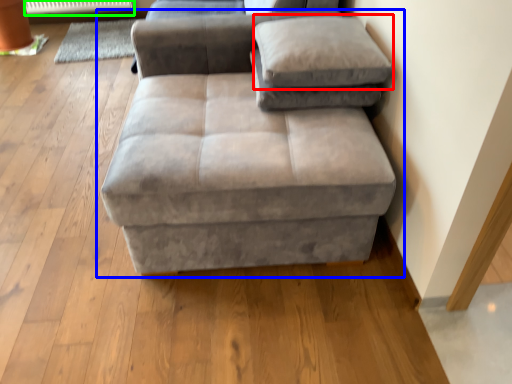
Question: Which is nearer to the pillow (highlighted by a red box)? studio couch (highlighted by a blue box) or radiator (highlighted by a green box).

Choices:
 (A) studio couch
 (B) radiator

Answer: (A)